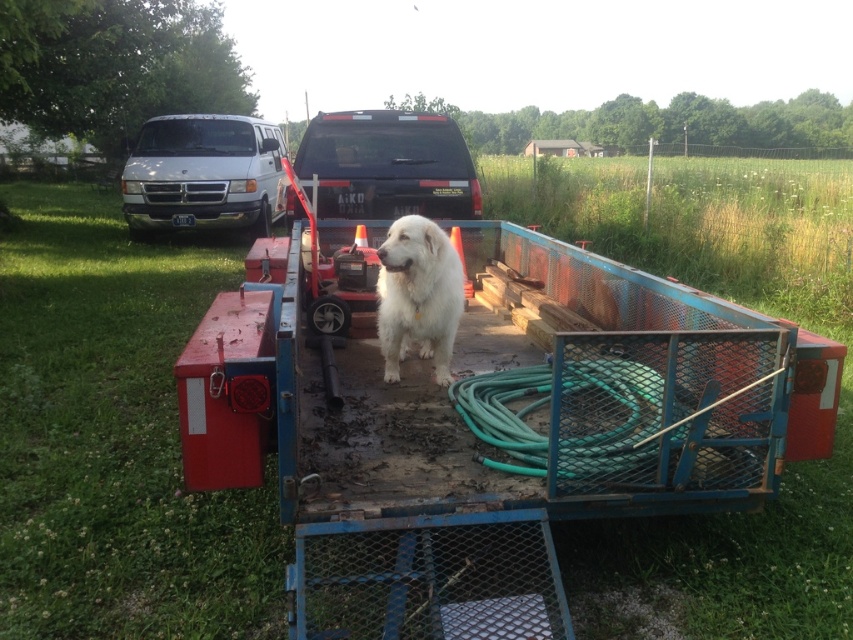
What do you see at coordinates (202, 173) in the screenshot? The height and width of the screenshot is (640, 853). I see `white matte van at upper left` at bounding box center [202, 173].

The width and height of the screenshot is (853, 640). What do you see at coordinates (202, 173) in the screenshot?
I see `white matte van at upper left` at bounding box center [202, 173].

Identify the location of white matte van at upper left. (202, 173).

Does matte black truck at center come behind green rubber garden hose at center?

Yes, it is.

Can you confirm if matte black truck at center is positioned below green rubber garden hose at center?

No, matte black truck at center is not below green rubber garden hose at center.

Describe the element at coordinates (387, 164) in the screenshot. I see `matte black truck at center` at that location.

The height and width of the screenshot is (640, 853). I want to click on matte black truck at center, so click(387, 164).

How distant is white matte van at upper left from green rubber garden hose at center?

They are 8.37 meters apart.

Can you confirm if white matte van at upper left is shorter than green rubber garden hose at center?

No.

What do you see at coordinates (202, 173) in the screenshot? I see `white matte van at upper left` at bounding box center [202, 173].

The width and height of the screenshot is (853, 640). I want to click on white matte van at upper left, so click(202, 173).